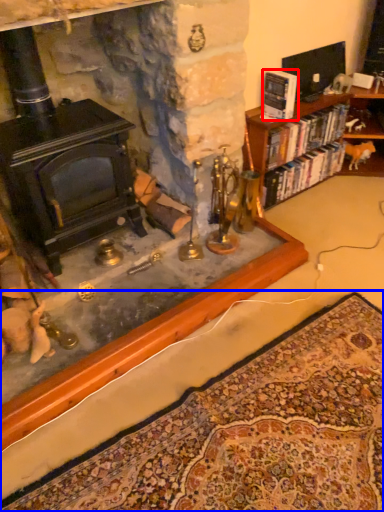
Question: Among these objects, which one is farthest to the camera, book (highlighted by a red box) or mat (highlighted by a blue box)?

Choices:
 (A) book
 (B) mat

Answer: (A)